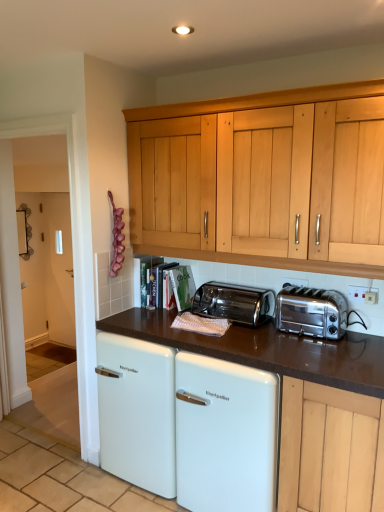
Where is `vacant point to the left of satin chrome toaster at right, acting as the second toaster starting from the left`? vacant point to the left of satin chrome toaster at right, acting as the second toaster starting from the left is located at coordinates (266, 340).